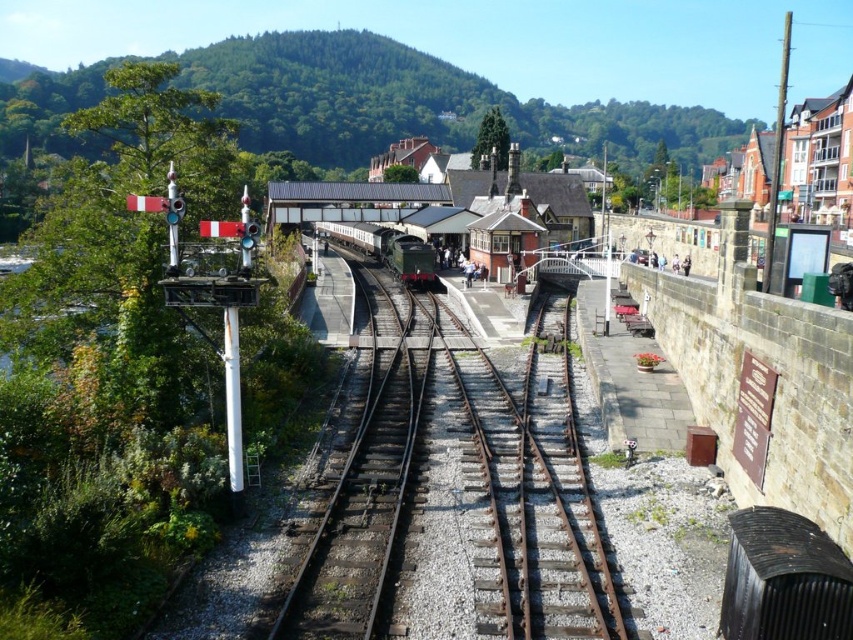
You are standing at the railway station and want to know how far the point at coordinates (416,360) is from your current position. Can you determine the distance?

The point at coordinates (416,360) is 27.80 meters away from your current position.

You are a maintenance worker needing to inspect both the rusty metal tracks at center and the green polished wood train at center. Based on their positions, which one should you check first if you start from the ground level?

The rusty metal tracks at center is located below the green polished wood train at center, so you should check the rusty metal tracks at center first as it is closer to ground level.

You are a maintenance worker checking the railway station. You need to determine if the rusty metal tracks at center can support the weight of the green polished wood train at center. Can you confirm based on their heights?

The rusty metal tracks at center has a lesser height compared to green polished wood train at center, which suggests that the tracks might not be tall enough to properly support the train. However, height alone isn not a definitive indicator of load capacity. Additional factors like material strength and track design should be considered for a thorough assessment.